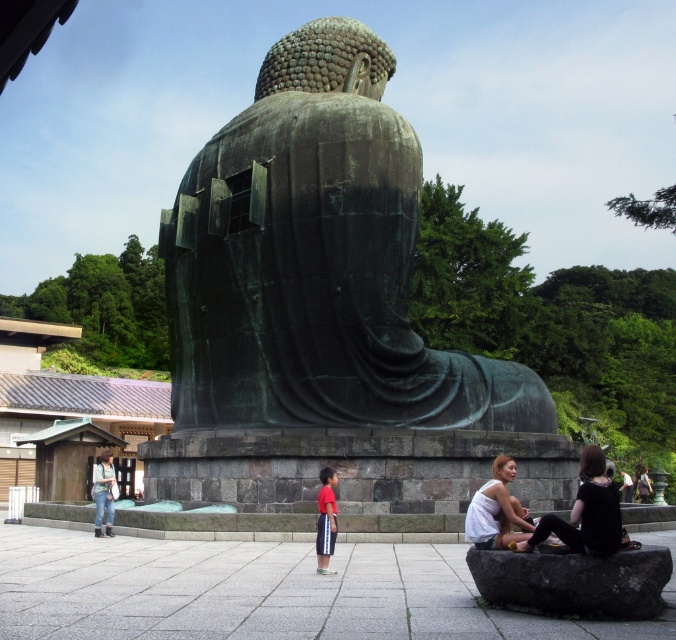
Question: In this image, where is green patina bronze statue at center located relative to black fabric dress at lower right?

Choices:
 (A) above
 (B) below

Answer: (A)

Question: Is green patina bronze statue at center below white matte shirt at lower right?

Choices:
 (A) no
 (B) yes

Answer: (A)

Question: Which point is closer to the camera taking this photo?

Choices:
 (A) (337, 529)
 (B) (508, 529)
 (C) (291, 192)
 (D) (544, 522)

Answer: (D)

Question: Which object is the closest to the red cotton shorts at center?

Choices:
 (A) black fabric dress at lower right
 (B) green patina bronze statue at center
 (C) white matte shirt at lower right

Answer: (C)

Question: Does white matte shirt at lower right have a larger size compared to red cotton shorts at center?

Choices:
 (A) no
 (B) yes

Answer: (B)

Question: Estimate the real-world distances between objects in this image. Which object is farther from the green patina bronze statue at center?

Choices:
 (A) black fabric dress at lower right
 (B) red cotton shorts at center

Answer: (A)